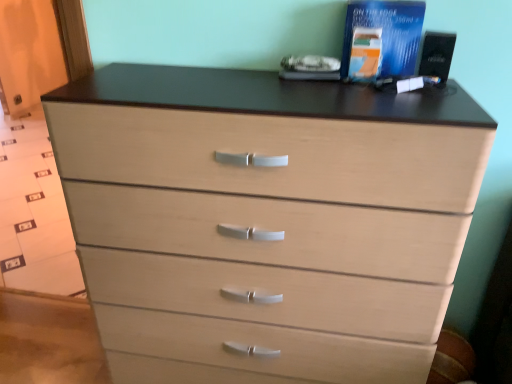
Question: From a real-world perspective, is blue matte book at upper right, the first book positioned from the right, over blue paper at upper right, the first book from the left?

Choices:
 (A) yes
 (B) no

Answer: (A)

Question: Considering the relative sizes of blue matte book at upper right, which is the 2th book from left to right, and blue paper at upper right, the first book from the left, in the image provided, is blue matte book at upper right, which is the 2th book from left to right, taller than blue paper at upper right, the first book from the left,?

Choices:
 (A) no
 (B) yes

Answer: (B)

Question: From the image's perspective, does blue matte book at upper right, which is the 2th book from left to right, appear higher than blue paper at upper right, the first book from the left?

Choices:
 (A) yes
 (B) no

Answer: (A)

Question: Can you confirm if blue matte book at upper right, the first book positioned from the right, is thinner than blue paper at upper right, the second book in the right-to-left sequence?

Choices:
 (A) yes
 (B) no

Answer: (B)

Question: Can blue paper at upper right, the second book in the right-to-left sequence, be found inside blue matte book at upper right, the first book positioned from the right?

Choices:
 (A) yes
 (B) no

Answer: (B)

Question: Is blue matte book at upper right, which is the 2th book from left to right, positioned with its back to blue paper at upper right, the second book in the right-to-left sequence?

Choices:
 (A) no
 (B) yes

Answer: (B)

Question: Are blue paper at upper right, the second book in the right-to-left sequence, and blue matte book at upper right, the first book positioned from the right, beside each other?

Choices:
 (A) yes
 (B) no

Answer: (A)

Question: From the image's perspective, is blue paper at upper right, the second book in the right-to-left sequence, over blue matte book at upper right, which is the 2th book from left to right?

Choices:
 (A) yes
 (B) no

Answer: (B)

Question: Is blue paper at upper right, the second book in the right-to-left sequence, positioned far away from blue matte book at upper right, the first book positioned from the right?

Choices:
 (A) yes
 (B) no

Answer: (B)

Question: Is blue paper at upper right, the first book from the left, at the left side of blue matte book at upper right, which is the 2th book from left to right?

Choices:
 (A) no
 (B) yes

Answer: (B)

Question: Is blue matte book at upper right, the first book positioned from the right, completely or partially inside blue paper at upper right, the first book from the left?

Choices:
 (A) yes
 (B) no

Answer: (B)

Question: Is blue paper at upper right, the first book from the left, not inside blue matte book at upper right, which is the 2th book from left to right?

Choices:
 (A) no
 (B) yes

Answer: (B)

Question: Is blue matte book at upper right, which is the 2th book from left to right, taller or shorter than blue paper at upper right, the first book from the left?

Choices:
 (A) short
 (B) tall

Answer: (B)